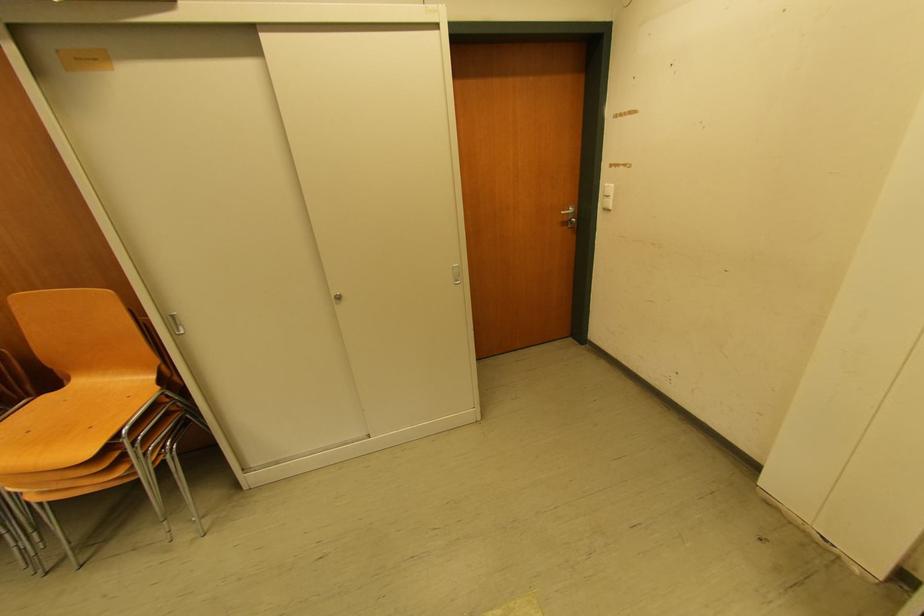
Where is `orange chair sitting surface`? Image resolution: width=924 pixels, height=616 pixels. orange chair sitting surface is located at coordinates (89, 410).